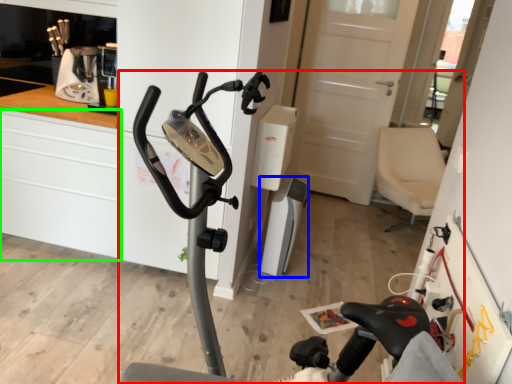
Question: Based on their relative distances, which object is nearer to stationary bicycle (highlighted by a red box)? Choose from appliance (highlighted by a blue box) and cabinetry (highlighted by a green box).

Choices:
 (A) appliance
 (B) cabinetry

Answer: (A)